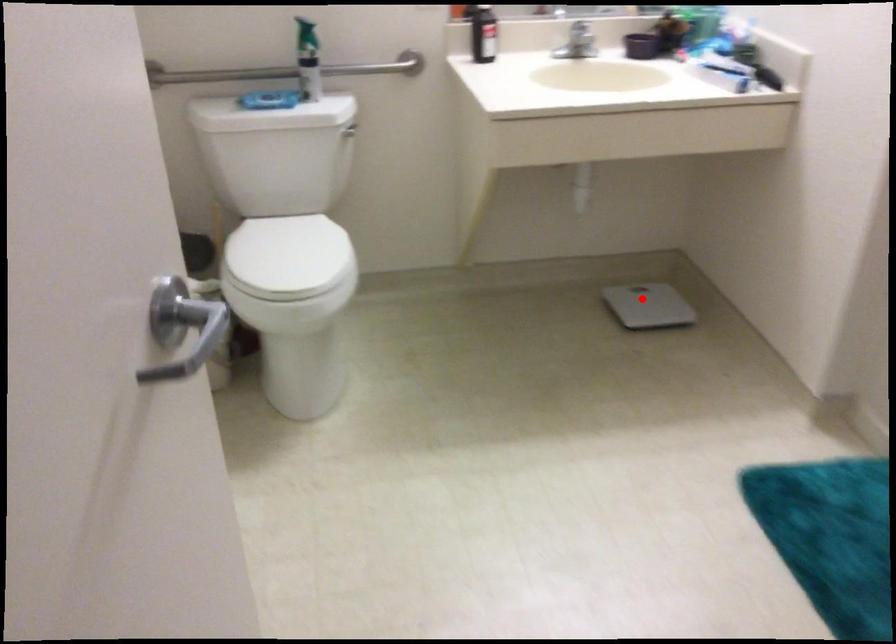
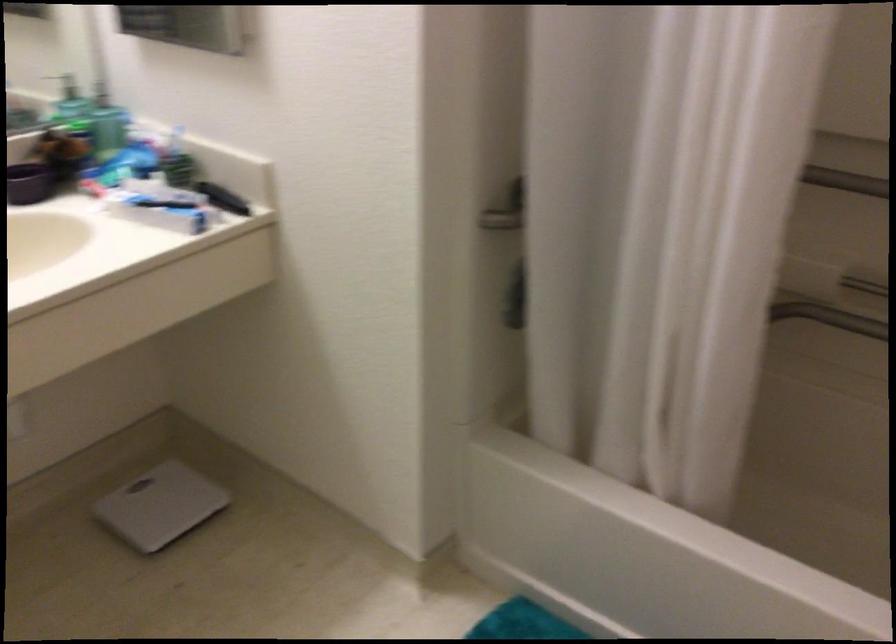
The point at the highlighted location is marked in the first image. Where is the corresponding point in the second image?

(159, 506)